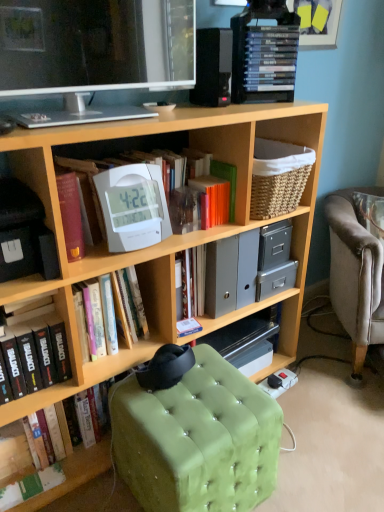
Question: Is black matte book at lower left, marked as the second book in a bottom-to-top arrangement, to the left or to the right of white plastic clock at center, arranged as the second book when viewed from the top, in the image?

Choices:
 (A) left
 (B) right

Answer: (A)

Question: Considering the positions of black matte book at lower left, marked as the second book in a bottom-to-top arrangement, and white plastic clock at center, the fourth book in the bottom-to-top sequence, in the image, is black matte book at lower left, marked as the second book in a bottom-to-top arrangement, wider or thinner than white plastic clock at center, the fourth book in the bottom-to-top sequence,?

Choices:
 (A) thin
 (B) wide

Answer: (B)

Question: Which is farther from the light gray fabric armchair at right?

Choices:
 (A) black matte book at lower left, which is the fourth book in top-to-bottom order
 (B) green tufted ottoman at lower center
 (C) green paper book at lower left, which appears as the 1th book when ordered from the bottom
 (D) gray plastic file folders at center
 (E) white plastic clock at upper center, the 3th book positioned from the bottom

Answer: (C)

Question: Estimate the real-world distances between objects in this image. Which object is closer to the light gray fabric armchair at right?

Choices:
 (A) black matte book at upper right, the 5th book when ordered from bottom to top
 (B) black cardboard box at left
 (C) orange matte paper at center
 (D) white plastic clock at upper center
 (E) white plastic clock at center, the fourth book in the bottom-to-top sequence

Answer: (C)